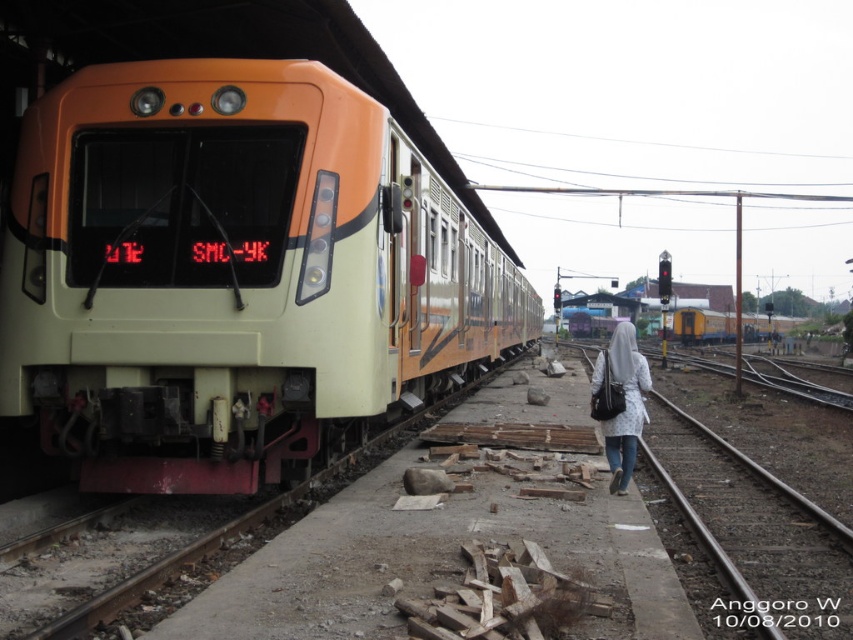
Question: Does brown gravel train track at lower right lie in front of yellow matte train at center?

Choices:
 (A) yes
 (B) no

Answer: (A)

Question: Is brown gravel train track at lower right positioned in front of white textured coat at center?

Choices:
 (A) no
 (B) yes

Answer: (B)

Question: Estimate the real-world distances between objects in this image. Which object is farther from the white textured coat at center?

Choices:
 (A) orange matte train at center
 (B) brown gravel train track at lower right

Answer: (A)

Question: Which of these objects is positioned farthest from the orange matte train at center?

Choices:
 (A) white textured coat at center
 (B) brown gravel train track at lower right

Answer: (B)

Question: Which point appears farthest from the camera in this image?

Choices:
 (A) (x=642, y=376)
 (B) (x=810, y=531)
 (C) (x=724, y=333)
 (D) (x=157, y=461)

Answer: (C)

Question: Is orange matte train at center thinner than brown gravel train track at lower right?

Choices:
 (A) yes
 (B) no

Answer: (A)